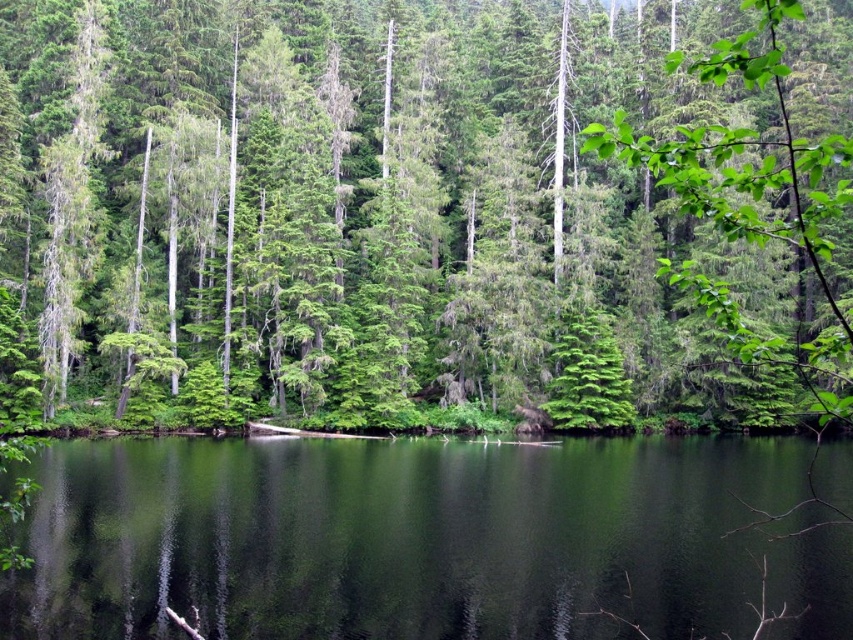
Question: Can you confirm if green matte tree at center is positioned to the right of green reflective water at center?

Choices:
 (A) yes
 (B) no

Answer: (B)

Question: Which object appears closest to the camera in this image?

Choices:
 (A) green reflective water at center
 (B) green matte tree at center

Answer: (B)

Question: Which point appears farthest from the camera in this image?

Choices:
 (A) (703, 280)
 (B) (102, 532)

Answer: (B)

Question: From the image, what is the correct spatial relationship of green matte tree at center in relation to green reflective water at center?

Choices:
 (A) right
 (B) left

Answer: (B)

Question: Can you confirm if green matte tree at center is positioned below green reflective water at center?

Choices:
 (A) yes
 (B) no

Answer: (B)